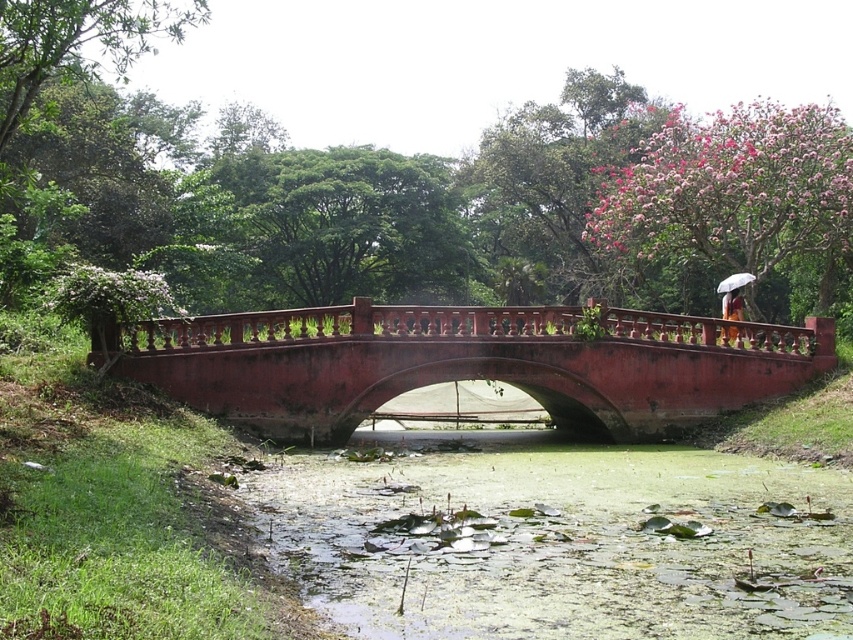
You are planning to cross the smooth red bridge at center with a large backpack. Considering the size of the bridge and the white matte umbrella at upper right, do you think the bridge can accommodate your backpack?

The smooth red bridge at center has a larger size compared to the white matte umbrella at upper right, so the bridge is spacious enough to accommodate your backpack.

You are standing on the ground near the smooth red bridge at center and want to take a photo of the white matte umbrella at upper right. Since the bridge is in the way, will you need to adjust your position to ensure the umbrella is fully visible?

The smooth red bridge at center is taller than the white matte umbrella at upper right, so the bridge may block part of the umbrella. To ensure the umbrella is fully visible, you might need to move to a position where the bridge doesn